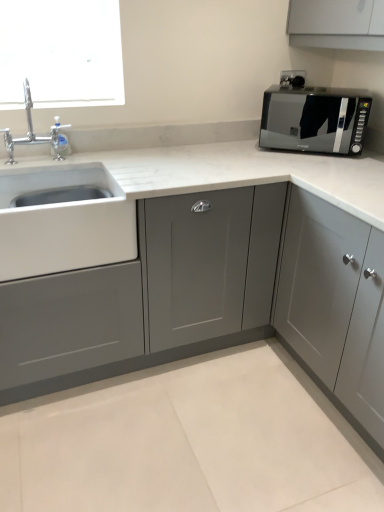
Question: Considering the positions of point (56, 157) and point (223, 267), is point (56, 157) closer or farther from the camera than point (223, 267)?

Choices:
 (A) closer
 (B) farther

Answer: (B)

Question: In the image, is chrome metallic faucet at upper left on the left side or the right side of matte gray cabinet at center, acting as the second cabinetry starting from the right?

Choices:
 (A) left
 (B) right

Answer: (A)

Question: Which object is positioned farthest from the chrome metallic faucet at upper left?

Choices:
 (A) white matte sink at left
 (B) black glossy microwave at upper right
 (C) matte gray cabinet at center, placed as the first cabinetry when sorted from left to right
 (D) matte gray cabinet at upper right, arranged as the second cabinetry when viewed from the left

Answer: (D)

Question: Which object is the closest to the chrome metallic faucet at upper left?

Choices:
 (A) matte gray cabinet at upper right, which is the first cabinetry in right-to-left order
 (B) matte gray cabinet at center, placed as the first cabinetry when sorted from left to right
 (C) black glossy microwave at upper right
 (D) white matte sink at left

Answer: (D)